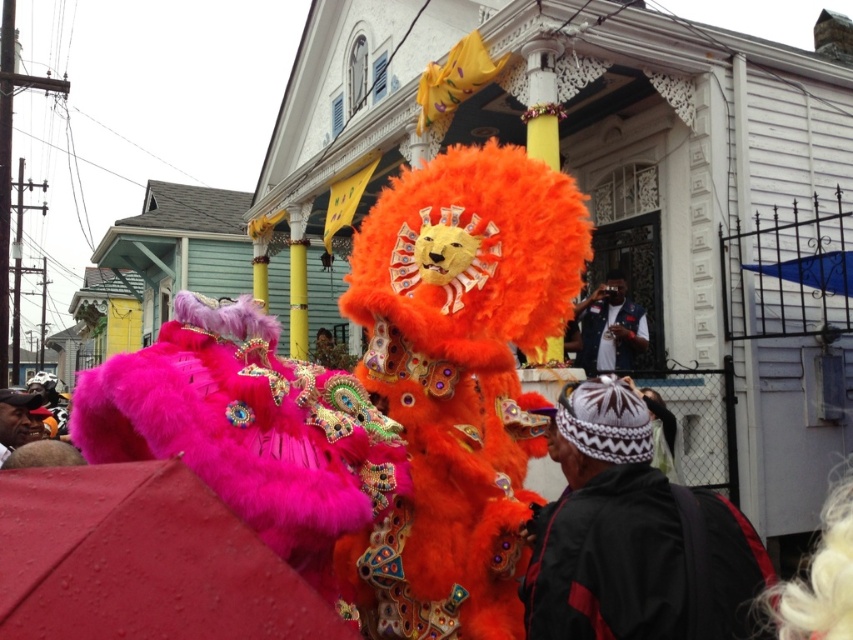
In the scene shown: You are standing at the center of the street and see the point marked at coordinates (248,428). What object is located at this point?

The point at (248,428) corresponds to the fuzzy pink costume at center.

You are a photographer trying to capture the vibrant street scene during the parade. You notice a denim vest at center and want to ensure it is in focus. Given that your camera has a depth of field that can sharply capture objects within a 0.5 unit range, can you confirm if the denim vest at center will be in focus if you focus on the point at coordinates (610, 326)?

The point at coordinates (610, 326) corresponds to the denim vest at center, so focusing on this point will ensure the denim vest at center is in focus.

Looking at this image, you are a photographer standing at the center of the street where the parade is happening. You want to take a photo that includes both points marked as point 1 at coordinates point (630, 321) and point 2 at coordinates point (13, 422). However, you need to ensure that neither point is blocked by any objects in the scene. Given the spatial relationship between these two points, which point should you prioritize keeping in the foreground to avoid obstruction?

You should prioritize keeping point (13, 422) in the foreground because point (630, 321) is behind it, so placing point (13, 422) closer to the camera will ensure it isn not blocked by the point behind it.